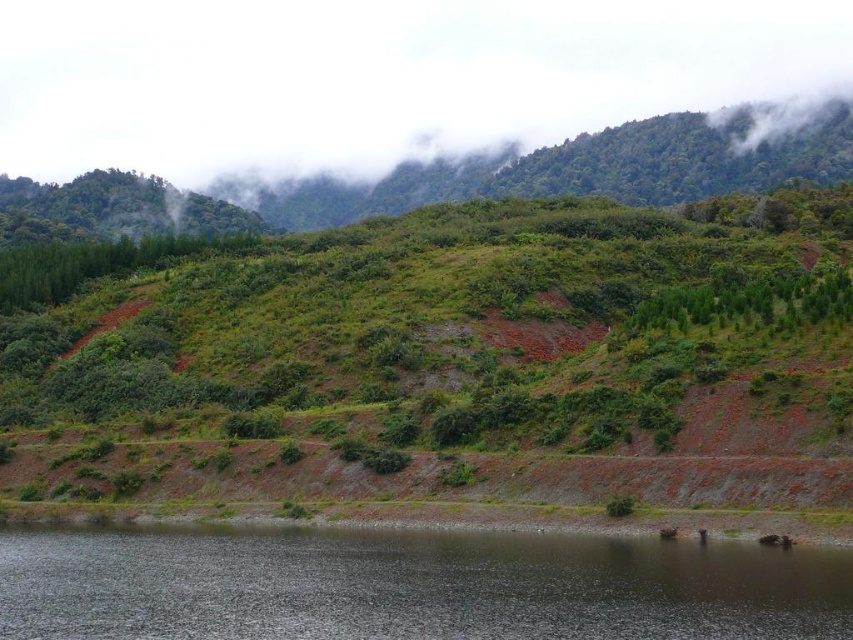
Question: Which object appears farthest from the camera in this image?

Choices:
 (A) green grassy hillside at center
 (B) dark reflective water at lower center

Answer: (A)

Question: Can you confirm if green grassy hillside at center is wider than dark reflective water at lower center?

Choices:
 (A) yes
 (B) no

Answer: (A)

Question: Does green grassy hillside at center come in front of dark reflective water at lower center?

Choices:
 (A) yes
 (B) no

Answer: (B)

Question: Which point is closer to the camera taking this photo?

Choices:
 (A) (746, 577)
 (B) (693, 442)

Answer: (A)

Question: Can you confirm if green grassy hillside at center is positioned to the left of dark reflective water at lower center?

Choices:
 (A) yes
 (B) no

Answer: (B)